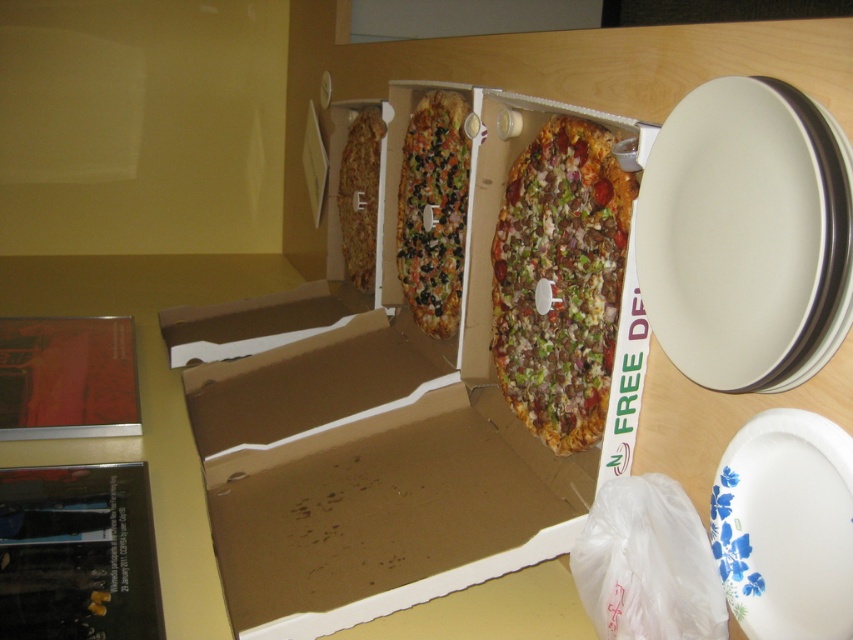
You are organizing items on a shelf and need to stack the brown cardboard box at center and the multicolored vegetable pizza at center. Which item should you place at the bottom to ensure stability?

The brown cardboard box at center is much taller than the multicolored vegetable pizza at center, so placing the taller brown cardboard box at center at the bottom would provide better stability due to its height and structural integrity.

Based on the photo, you are a delivery person who just arrived at a customer pickup location. You see the multicolored vegetable pizza at center and the crusty pizza slice at center. Which pizza is closer to the top of the box?

The crusty pizza slice at center is closer to the top of the box because the multicolored vegetable pizza at center is below it.

You are organizing items on a shelf and need to place both the brown cardboard box at center and the multicolored vegetable pizza at center. Which item should you place first if you want to ensure there is enough space for both?

The brown cardboard box at center might be wider than the multicolored vegetable pizza at center, so you should place the brown cardboard box at center first to ensure there is enough space for both items.